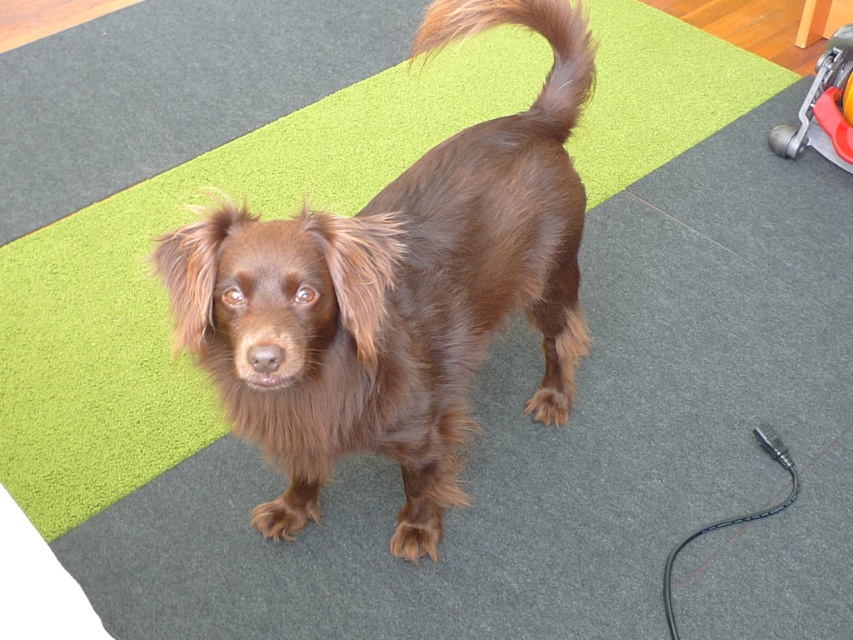
You are a photographer setting up a shoot with the brown furry dog at center and the brown furry tail at upper center in the frame. You need to ensure that the smaller object is fully visible. Which object should you focus on to avoid cropping the smaller one?

The brown furry tail at upper center is smaller than the brown furry dog at center, so you should focus on ensuring the brown furry tail at upper center is fully visible in the frame.

You are a pet sitter who needs to attach the black rubber leash at lower right to the brown furry dog at center. Based on their positions, can you reach the leash without moving the dog?

The brown furry dog at center is located above the black rubber leash at lower right, so yes, you can reach the leash without moving the dog because it is positioned below the dog.

You are a dog owner who wants to secure your dog using the black rubber leash at lower right. The orange plastic baby carriage at lower right is in the way. Can you move the baby carriage to the left to make space for the leash?

The orange plastic baby carriage at lower right is to the right of the black rubber leash at lower right. Since the baby carriage is already positioned to the right of the leash, moving it further to the left would place it closer to the leash, potentially blocking access. Therefore, moving the baby carriage to the left might not create enough space for the leash. Consider moving the carriage further to the right instead.